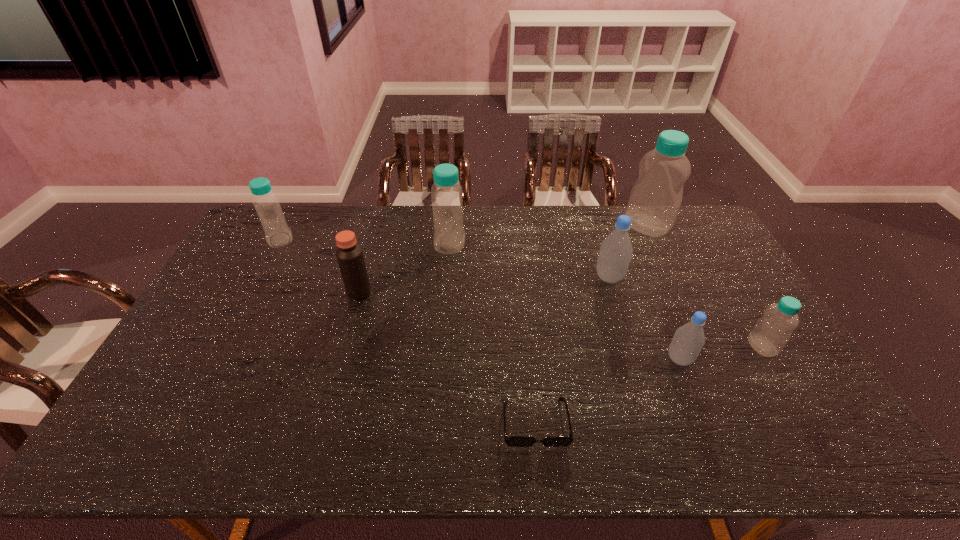
Find the location of a particular element. The height and width of the screenshot is (540, 960). the rightmost object is located at coordinates (772, 331).

Image resolution: width=960 pixels, height=540 pixels. Find the location of `the rightmost blue bottle`. the rightmost blue bottle is located at coordinates click(x=772, y=331).

Where is `the nearer gray bottle`? The height and width of the screenshot is (540, 960). the nearer gray bottle is located at coordinates (688, 340).

Where is `the smaller gray bottle`? Image resolution: width=960 pixels, height=540 pixels. the smaller gray bottle is located at coordinates (688, 340).

Where is `the fifth object from right to left`? the fifth object from right to left is located at coordinates (512, 441).

Locate an element on the screen. Image resolution: width=960 pixels, height=540 pixels. the shortest object is located at coordinates (512, 441).

Find the location of `vacant space located on the front of the tallest bottle`. vacant space located on the front of the tallest bottle is located at coordinates (670, 275).

This screenshot has width=960, height=540. I want to click on blank area located 0.220m on the front of the seventh shortest object, so (445, 303).

Locate an element on the screen. Image resolution: width=960 pixels, height=540 pixels. blank space located 0.080m on the front of the leftmost bottle is located at coordinates (267, 265).

Locate an element on the screen. vacant space located on the right of the fourth bottle from right to left is located at coordinates (700, 278).